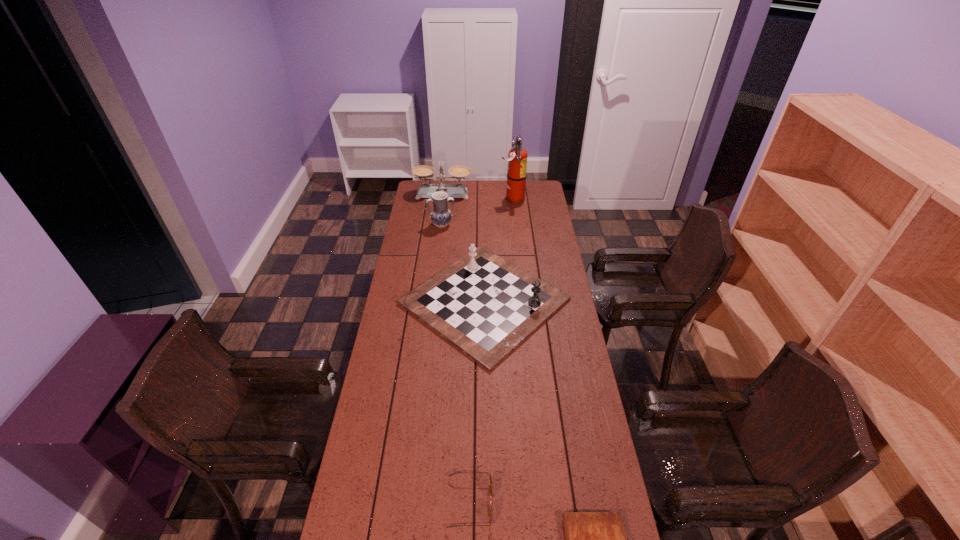
You are a GUI agent. You are given a task and a screenshot of the screen. Output one action in this format:
    pyautogui.click(x=<x>, y=<y>)
    Task: Click on the object that is at the far left corner
    
    Given the screenshot: What is the action you would take?
    pyautogui.click(x=424, y=172)

What are the coordinates of `object situated at the far right corner` in the screenshot? It's located at (517, 157).

Where is `vacant point at the far edge`? vacant point at the far edge is located at coordinates click(x=481, y=183).

The image size is (960, 540). I want to click on free space at the left edge of the desktop, so click(x=372, y=406).

Where is `free space at the right edge`? This screenshot has width=960, height=540. free space at the right edge is located at coordinates (546, 219).

Where is `vacant area between the sunglasses and the third farthest object`? vacant area between the sunglasses and the third farthest object is located at coordinates 456,364.

The image size is (960, 540). I want to click on empty location between the fire extinguisher and the fourth tallest object, so click(x=498, y=250).

I want to click on vacant region between the third shortest object and the second shortest object, so click(x=477, y=402).

At what (x,y) coordinates should I click in order to perform the action: click on unoccupied area between the tallest object and the scale. Please return your answer as a coordinate pair (x, y). Looking at the image, I should click on (478, 197).

You are a GUI agent. You are given a task and a screenshot of the screen. Output one action in this format:
    pyautogui.click(x=<x>, y=<y>)
    Task: Click on the free space between the fire extinguisher and the fourth nearest object
    
    Given the screenshot: What is the action you would take?
    pyautogui.click(x=477, y=212)